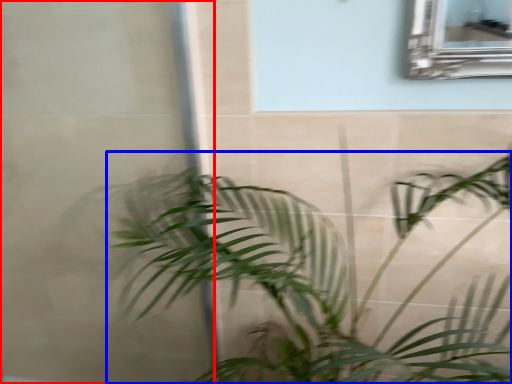
Question: Which object appears farthest to the camera in this image, glass door (highlighted by a red box) or houseplant (highlighted by a blue box)?

Choices:
 (A) glass door
 (B) houseplant

Answer: (A)